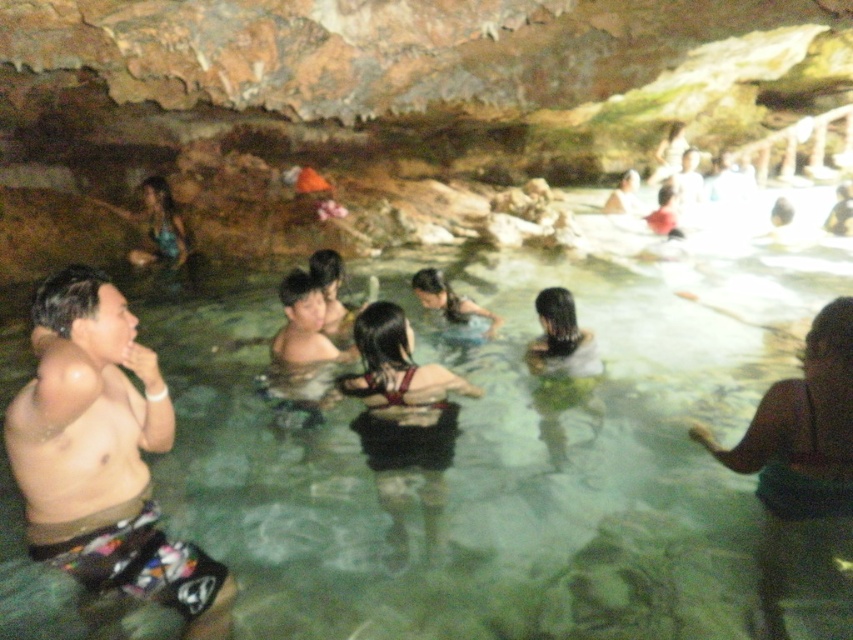
You are a photographer trying to capture the perfect shot of the dark brown skin at center and the dark red bikini top at center in the cave pool. Based on their sizes, which object would you focus on first to ensure clarity in your photo?

The dark brown skin at center is thinner than the dark red bikini top at center, so focusing on the dark red bikini top at center first would ensure clarity since it has a larger size.

You are standing outside the cave and want to take a photo of the dark brown hair at center. If your camera has a maximum focus range of 5 meters, will you be able to capture it clearly?

The dark brown hair at center is 5.38 meters away from the viewer. Since the camera can only focus up to 5 meters, it won t be able to capture the dark brown hair at center clearly.

You are a photographer trying to capture a photo of the dark red bikini top at center and the matte red swimsuit at upper right. Which one is located lower in the image?

The dark red bikini top at center is positioned under the matte red swimsuit at upper right, so it is located lower in the image.